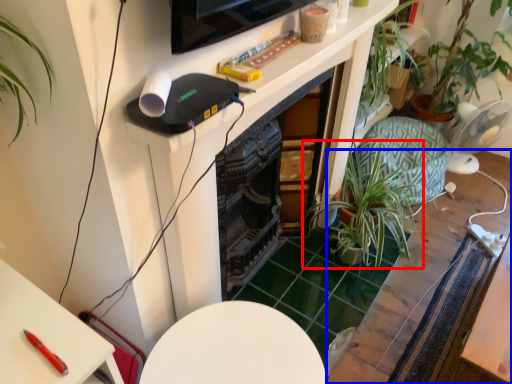
Question: Which object is closer to the camera taking this photo, houseplant (highlighted by a red box) or table (highlighted by a blue box)?

Choices:
 (A) houseplant
 (B) table

Answer: (B)